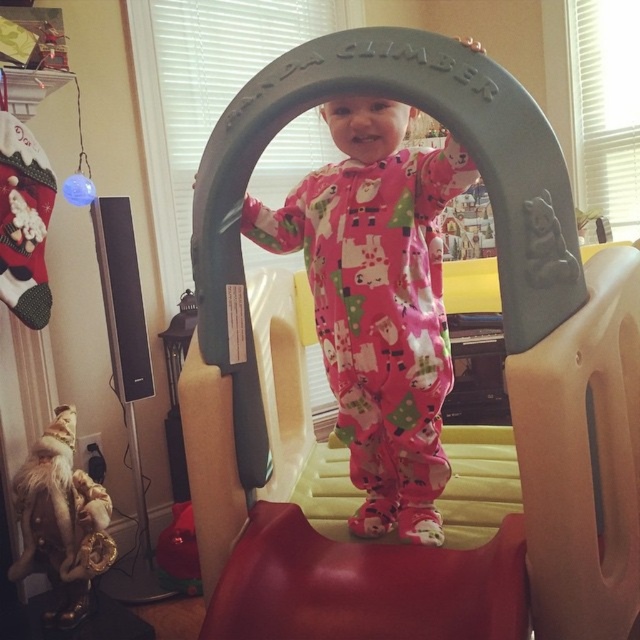
You are a parent trying to locate your child in the play area. You see the pink cotton onesie at center and the fuzzy fabric plush at lower left. Which item is nearer to you?

The pink cotton onesie at center is closer to the viewer than the fuzzy fabric plush at lower left, so the pink cotton onesie at center is nearer to you.

Looking at this image, you are a parent looking at the Play n Climb play structure. You see the pink cotton onesie at center and the fuzzy fabric plush at lower left. Which item is bigger?

The pink cotton onesie at center is larger in size compared to the fuzzy fabric plush at lower left.

Based on the scene description, can you determine the exact coordinates of the plastic at center?

The plastic at center is located at the coordinates point (506,378).